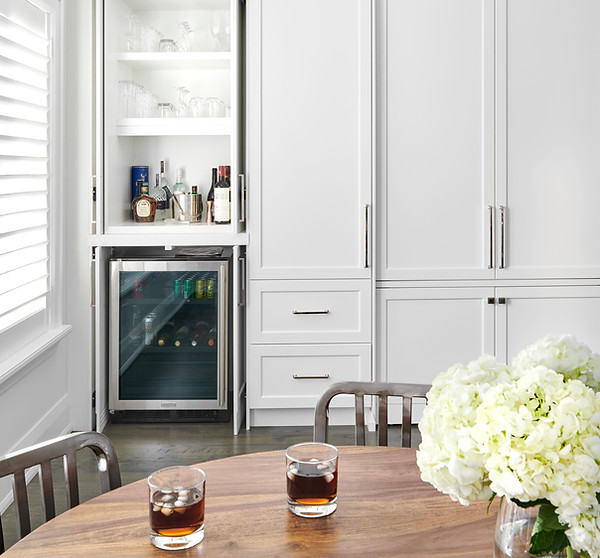
The image size is (600, 558). Identify the location of glass. (317, 481), (173, 511).